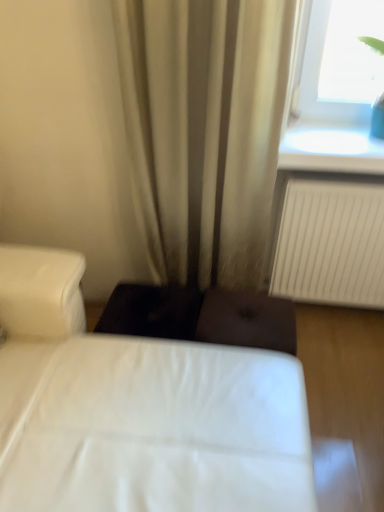
Question: Considering the relative sizes of transparent glass at upper right and beige fabric curtain at center in the image provided, is transparent glass at upper right shorter than beige fabric curtain at center?

Choices:
 (A) yes
 (B) no

Answer: (A)

Question: From the image's perspective, is transparent glass at upper right on beige fabric curtain at center?

Choices:
 (A) yes
 (B) no

Answer: (A)

Question: Can you confirm if transparent glass at upper right is smaller than beige fabric curtain at center?

Choices:
 (A) yes
 (B) no

Answer: (A)

Question: Are transparent glass at upper right and beige fabric curtain at center beside each other?

Choices:
 (A) no
 (B) yes

Answer: (A)

Question: Is transparent glass at upper right bigger than beige fabric curtain at center?

Choices:
 (A) yes
 (B) no

Answer: (B)

Question: Are transparent glass at upper right and beige fabric curtain at center far apart?

Choices:
 (A) yes
 (B) no

Answer: (B)

Question: From the image's perspective, is beige fabric curtain at center under white fabric bed at center?

Choices:
 (A) yes
 (B) no

Answer: (B)

Question: Considering the relative sizes of beige fabric curtain at center and white fabric bed at center in the image provided, is beige fabric curtain at center shorter than white fabric bed at center?

Choices:
 (A) no
 (B) yes

Answer: (A)

Question: Does beige fabric curtain at center have a smaller size compared to white fabric bed at center?

Choices:
 (A) no
 (B) yes

Answer: (B)

Question: Is beige fabric curtain at center bigger than white fabric bed at center?

Choices:
 (A) no
 (B) yes

Answer: (A)

Question: Is the depth of beige fabric curtain at center greater than that of white fabric bed at center?

Choices:
 (A) yes
 (B) no

Answer: (A)

Question: Considering the relative sizes of beige fabric curtain at center and white fabric bed at center in the image provided, is beige fabric curtain at center thinner than white fabric bed at center?

Choices:
 (A) yes
 (B) no

Answer: (A)

Question: Can you confirm if white fabric bed at center is smaller than beige fabric curtain at center?

Choices:
 (A) yes
 (B) no

Answer: (B)